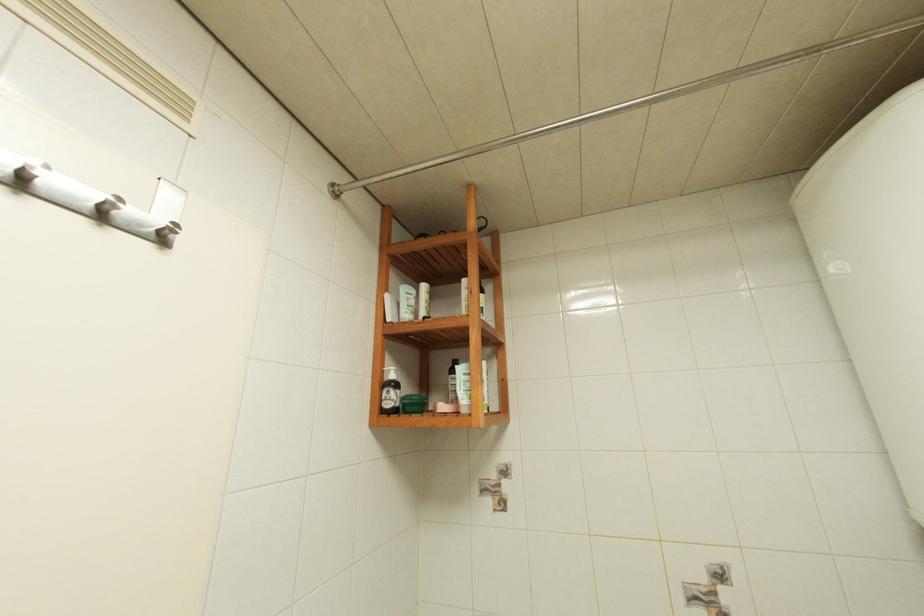
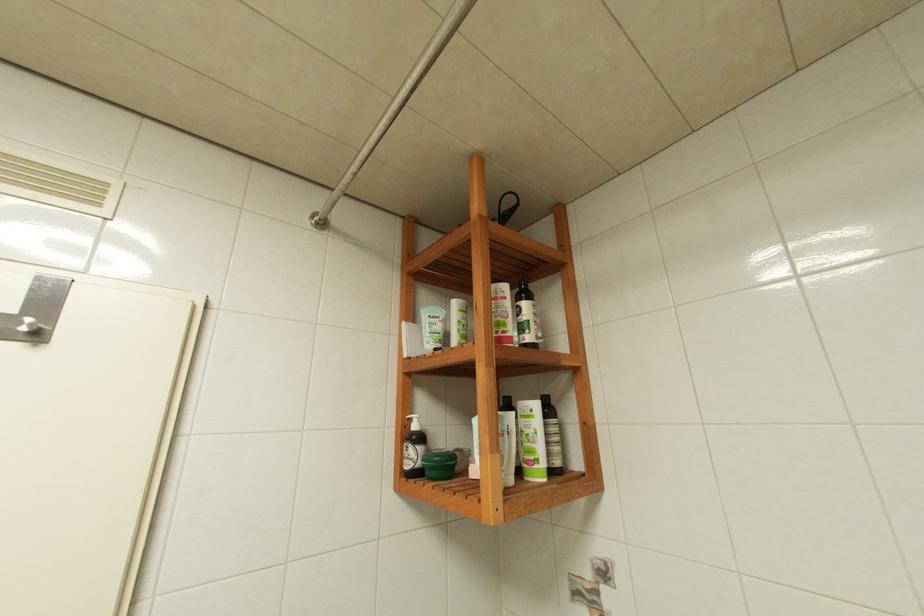
Question: The images are taken continuously from a first-person perspective. In which direction is your viewpoint rotating?

Choices:
 (A) Left
 (B) Right
 (C) Up
 (D) Down

Answer: (A)